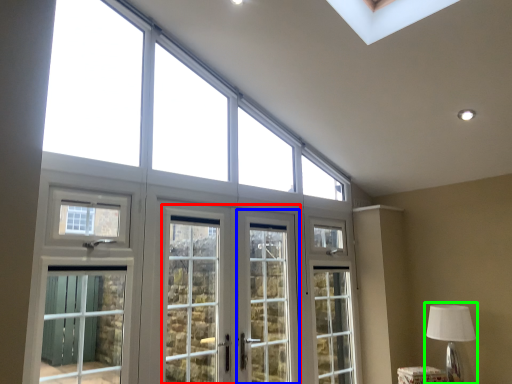
Question: Estimate the real-world distances between objects in this image. Which object is closer to screen door (highlighted by a red box), screen door (highlighted by a blue box) or table lamp (highlighted by a green box)?

Choices:
 (A) screen door
 (B) table lamp

Answer: (A)